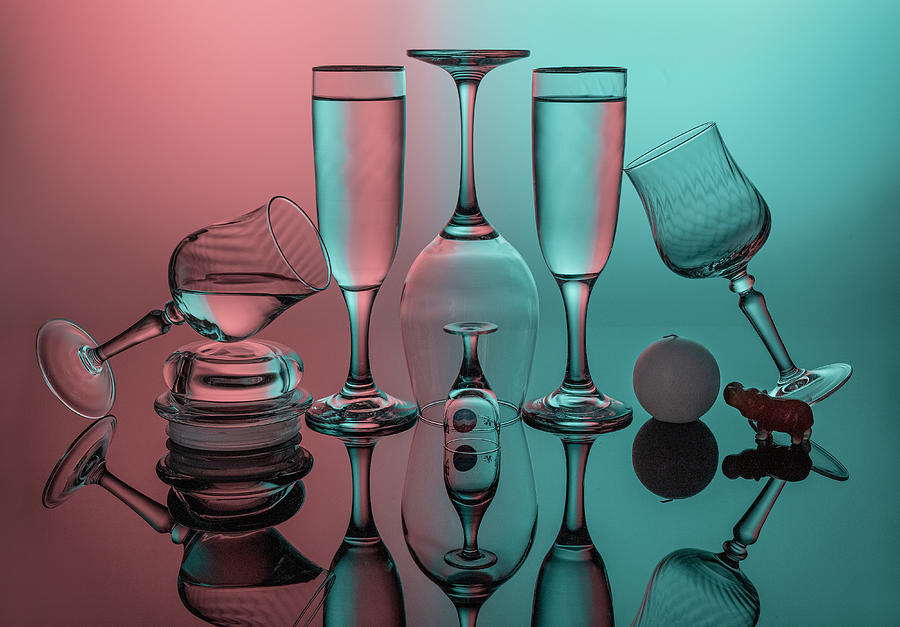
I want to click on artwork, so click(492, 345).